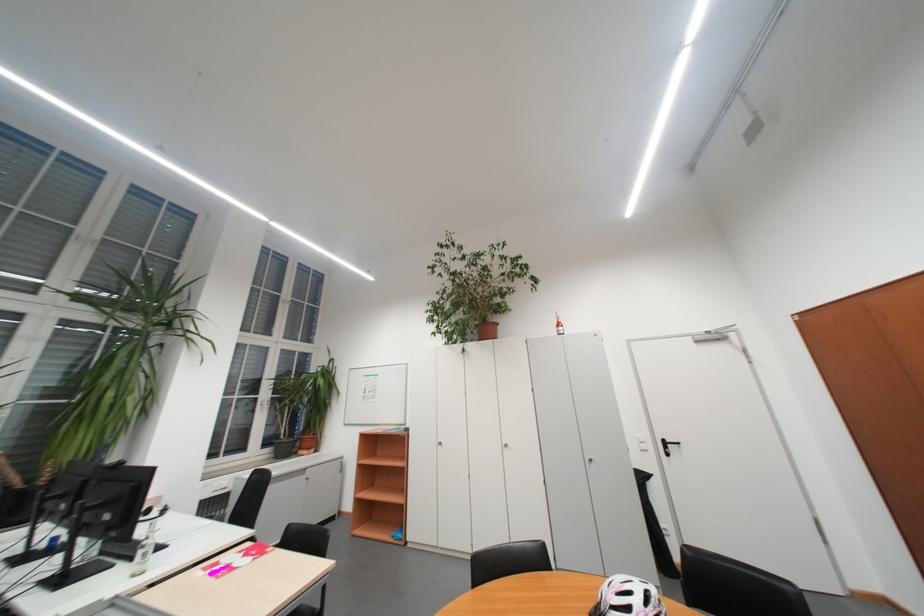
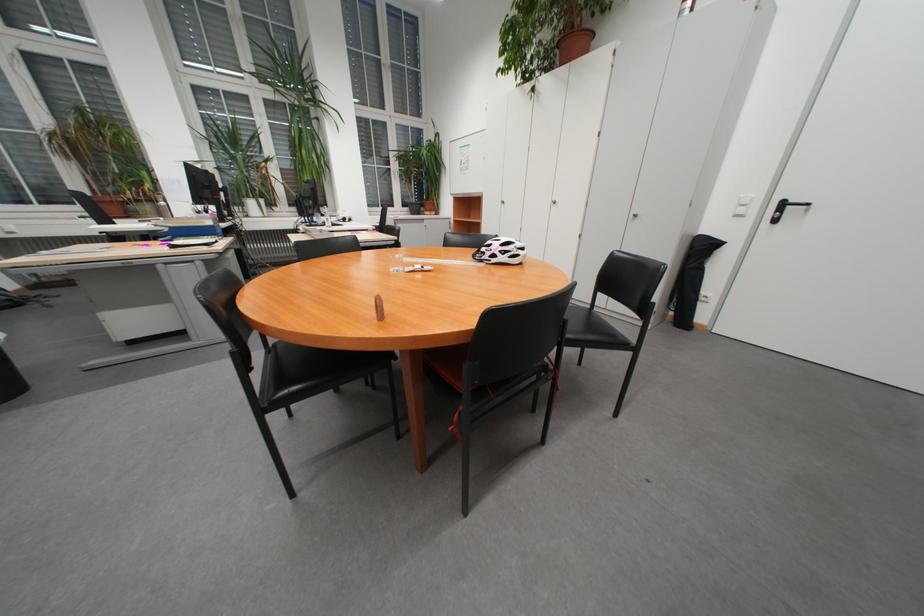
Locate, in the second image, the point that corresponds to the point at 676,444 in the first image.

(795, 205)